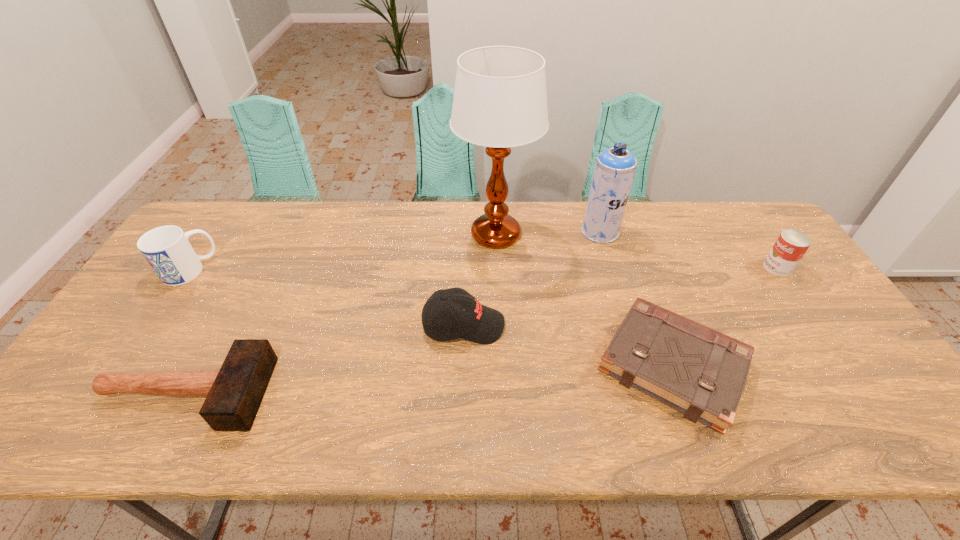
Where is `mug that is at the left edge`? Image resolution: width=960 pixels, height=540 pixels. mug that is at the left edge is located at coordinates (167, 249).

The width and height of the screenshot is (960, 540). In order to click on mallet present at the left edge in this screenshot , I will do `click(234, 393)`.

Locate an element on the screen. object situated at the right edge is located at coordinates (791, 245).

Where is `object that is positioned at the near left corner`? object that is positioned at the near left corner is located at coordinates (234, 393).

Locate an element on the screen. The image size is (960, 540). free space at the far edge is located at coordinates (413, 222).

Image resolution: width=960 pixels, height=540 pixels. I want to click on vacant space at the near edge, so click(x=824, y=431).

This screenshot has width=960, height=540. What are the coordinates of `vacant area at the right edge` in the screenshot? It's located at (785, 299).

In order to click on free space at the far right corner of the desktop in this screenshot , I will do `click(740, 224)`.

This screenshot has width=960, height=540. Identify the location of vacant space at the near right corner. (853, 407).

Find the location of a particular element. The width and height of the screenshot is (960, 540). free space between the mallet and the hardback book is located at coordinates (429, 379).